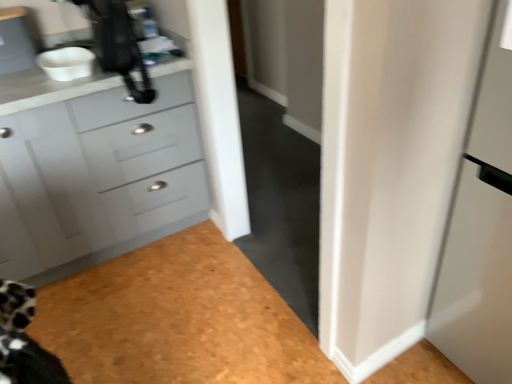
Question: Looking at their shapes, would you say matte gray cabinet at left is wider or thinner than white matte bowl at upper left?

Choices:
 (A) wide
 (B) thin

Answer: (A)

Question: From the image's perspective, relative to white matte bowl at upper left, is matte gray cabinet at left above or below?

Choices:
 (A) above
 (B) below

Answer: (B)

Question: Considering the real-world distances, which object is closest to the white glossy door at right?

Choices:
 (A) matte gray cabinet at upper left
 (B) matte gray cabinet at left
 (C) white matte bowl at upper left
 (D) black plastic coffee machine at upper left

Answer: (D)

Question: Estimate the real-world distances between objects in this image. Which object is farther from the matte gray cabinet at left?

Choices:
 (A) black plastic coffee machine at upper left
 (B) matte gray cabinet at upper left
 (C) white glossy door at right
 (D) white matte bowl at upper left

Answer: (C)